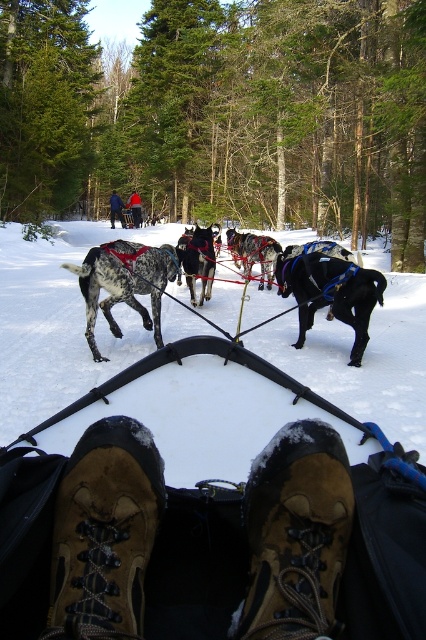
Question: Which point is closer to the camera taking this photo?

Choices:
 (A) (123, 220)
 (B) (23, 342)

Answer: (B)

Question: Does blue fabric jacket at upper center appear on the left side of brushed metal backpack at upper center?

Choices:
 (A) no
 (B) yes

Answer: (B)

Question: Which of the following is the farthest from the observer?

Choices:
 (A) white snow at center
 (B) brushed metal backpack at upper center

Answer: (B)

Question: Where is blue fabric jacket at upper center located in relation to brushed metal backpack at upper center in the image?

Choices:
 (A) left
 (B) right

Answer: (A)

Question: Does white snow at center appear under brushed metal backpack at upper center?

Choices:
 (A) no
 (B) yes

Answer: (B)

Question: Which of these objects is positioned closest to the white snow at center?

Choices:
 (A) brushed metal backpack at upper center
 (B) blue fabric jacket at upper center

Answer: (B)